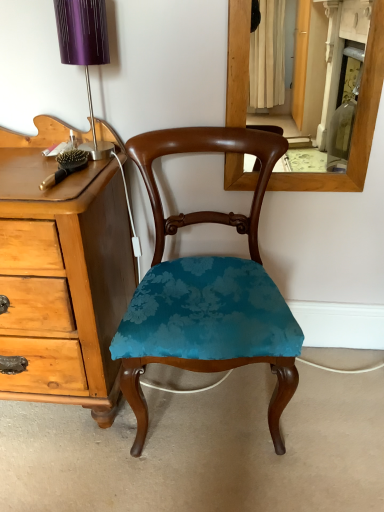
Question: Is teal velvet chair at center at the back of purple metallic table lamp at upper left?

Choices:
 (A) no
 (B) yes

Answer: (A)

Question: Does purple metallic table lamp at upper left have a greater height compared to teal velvet chair at center?

Choices:
 (A) yes
 (B) no

Answer: (B)

Question: Are purple metallic table lamp at upper left and teal velvet chair at center making contact?

Choices:
 (A) yes
 (B) no

Answer: (B)

Question: Is purple metallic table lamp at upper left not close to teal velvet chair at center?

Choices:
 (A) yes
 (B) no

Answer: (B)

Question: Does purple metallic table lamp at upper left have a lesser height compared to teal velvet chair at center?

Choices:
 (A) no
 (B) yes

Answer: (B)

Question: Is teal velvet chair at center a part of purple metallic table lamp at upper left?

Choices:
 (A) no
 (B) yes

Answer: (A)

Question: From a real-world perspective, does teal velvet chair at center sit lower than purple metallic table lamp at upper left?

Choices:
 (A) no
 (B) yes

Answer: (B)

Question: Does teal velvet chair at center appear on the right side of purple metallic table lamp at upper left?

Choices:
 (A) yes
 (B) no

Answer: (A)

Question: Considering the relative positions of teal velvet chair at center and purple metallic table lamp at upper left in the image provided, is teal velvet chair at center to the left of purple metallic table lamp at upper left from the viewer's perspective?

Choices:
 (A) no
 (B) yes

Answer: (A)

Question: Can you confirm if teal velvet chair at center is taller than purple metallic table lamp at upper left?

Choices:
 (A) yes
 (B) no

Answer: (A)

Question: Is teal velvet chair at center closer to camera compared to purple metallic table lamp at upper left?

Choices:
 (A) no
 (B) yes

Answer: (B)

Question: Is teal velvet chair at center shorter than purple metallic table lamp at upper left?

Choices:
 (A) yes
 (B) no

Answer: (B)

Question: In terms of height, does teal velvet chair at center look taller or shorter compared to purple metallic table lamp at upper left?

Choices:
 (A) tall
 (B) short

Answer: (A)